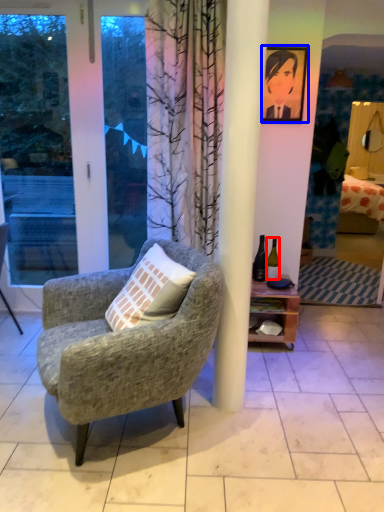
Question: Which object appears closest to the camera in this image, bottle (highlighted by a red box) or picture frame (highlighted by a blue box)?

Choices:
 (A) bottle
 (B) picture frame

Answer: (B)